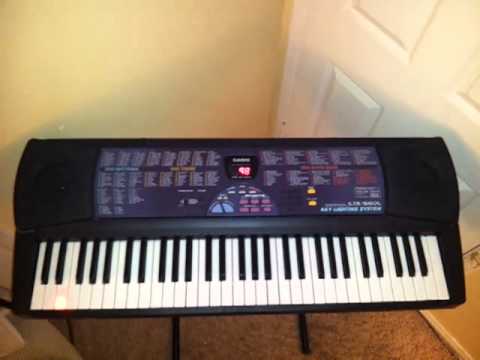
Image resolution: width=480 pixels, height=360 pixels. Identify the location of door hinge. (283, 121).